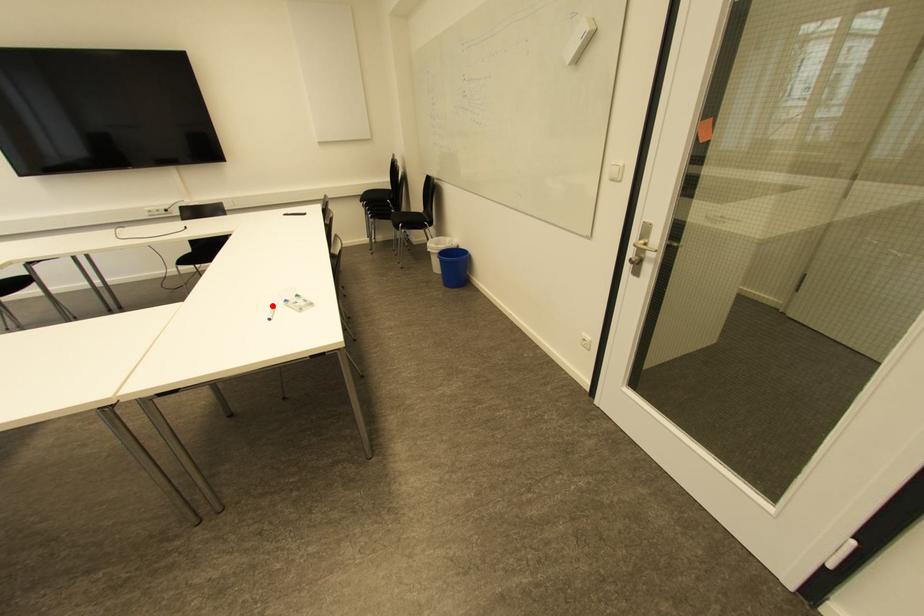
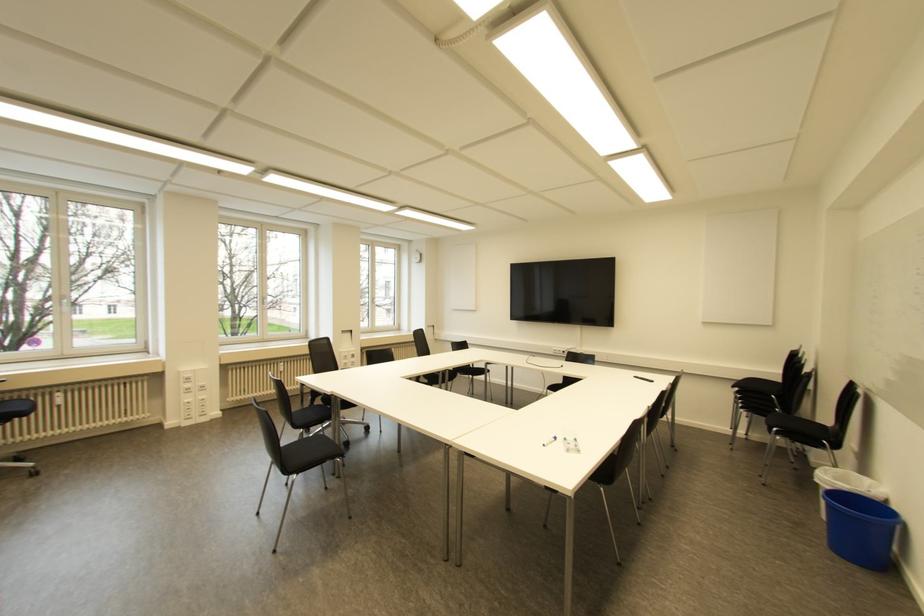
Locate, in the second image, the point that corresponds to the highlighted location in the first image.

(554, 438)